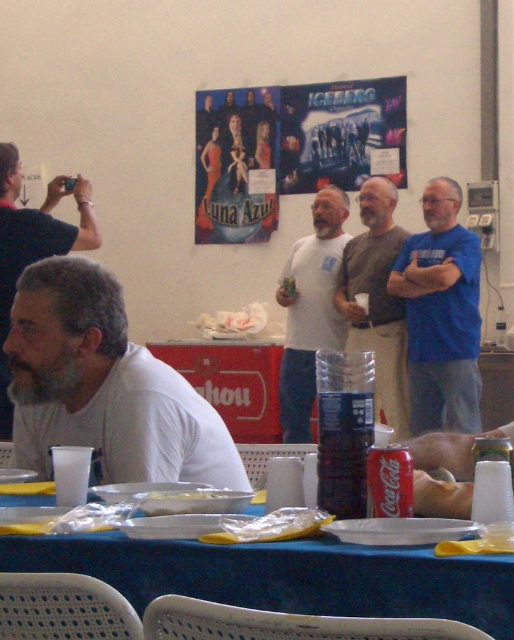
You are at a party and need to place a small decoration on the table. The gray fabric shirt at center and the white plastic bowl at center are both on the table. Which object is taller and can hold the decoration better?

The gray fabric shirt at center is much taller than the white plastic bowl at center, so it can hold the decoration better.

You are standing at the point labeled point (447, 580) and want to move to the point labeled point (139, 404). According to the scene description, is the path between these two points clear?

The path between point (139, 404) and point (447, 580) is clear because there are no objects blocking the way between them.